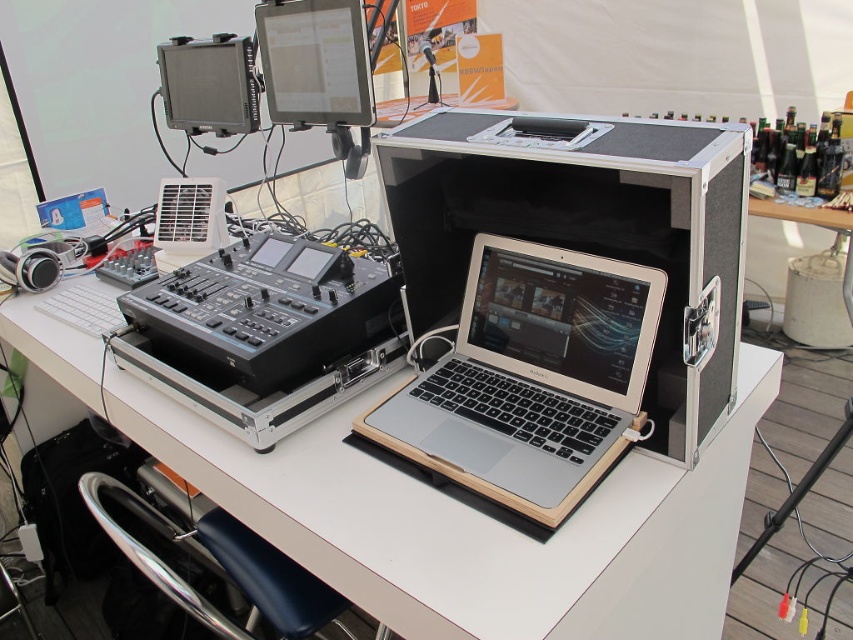
Is white matte computer desk at center thinner than silver metallic laptop at center?

No.

Is white matte computer desk at center taller than silver metallic laptop at center?

Indeed, white matte computer desk at center has a greater height compared to silver metallic laptop at center.

Image resolution: width=853 pixels, height=640 pixels. What do you see at coordinates (450, 512) in the screenshot? I see `white matte computer desk at center` at bounding box center [450, 512].

The height and width of the screenshot is (640, 853). Identify the location of white matte computer desk at center. (450, 512).

Does white matte computer desk at center have a smaller size compared to silver/black case at center?

No, white matte computer desk at center is not smaller than silver/black case at center.

Is white matte computer desk at center positioned in front of silver/black case at center?

That is True.

I want to click on white matte computer desk at center, so click(x=450, y=512).

What are the coordinates of `white matte computer desk at center` in the screenshot? It's located at (450, 512).

From the picture: Does silver metallic laptop at center appear on the right side of black plastic audio mixer at center?

Correct, you'll find silver metallic laptop at center to the right of black plastic audio mixer at center.

Is point (637, 387) positioned in front of point (310, 298)?

Yes, it is in front of point (310, 298).

Does point (558, 509) come in front of point (392, 308)?

Yes, point (558, 509) is in front of point (392, 308).

The height and width of the screenshot is (640, 853). Find the location of `silver metallic laptop at center`. silver metallic laptop at center is located at coordinates (531, 378).